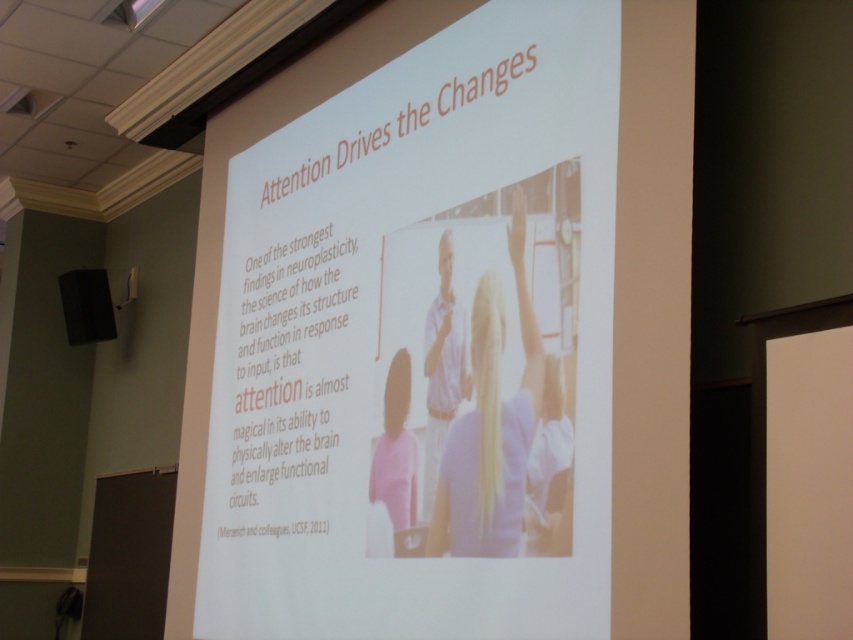
Between white shirt at center and pink matte shirt at lower center, which one has more height?

With more height is white shirt at center.

Which is behind, point (509, 440) or point (378, 500)?

Point (378, 500)

Is point (467, 490) positioned before point (398, 504)?

Yes, it is.

What are the coordinates of `white shirt at center` in the screenshot? It's located at point(491,426).

Who is more forward, (444,380) or (79,336)?

Positioned in front is point (444,380).

You are a GUI agent. You are given a task and a screenshot of the screen. Output one action in this format:
    pyautogui.click(x=<x>, y=<y>)
    Task: Click on the white cotton shirt at center
    This screenshot has height=640, width=853.
    Given the screenshot: What is the action you would take?
    pyautogui.click(x=444, y=365)

Find the location of a particular element. This screenshot has width=853, height=640. white shirt at center is located at coordinates [491, 426].

Can you confirm if white shirt at center is smaller than matte black speaker at left?

No.

What do you see at coordinates (491, 426) in the screenshot?
I see `white shirt at center` at bounding box center [491, 426].

At what (x,y) coordinates should I click in order to perform the action: click on white shirt at center. Please return your answer as a coordinate pair (x, y). The width and height of the screenshot is (853, 640). Looking at the image, I should click on (491, 426).